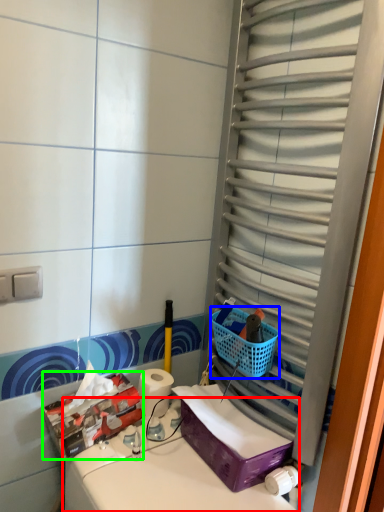
Question: Based on their relative distances, which object is farther from counter top (highlighted by a red box)? Choose from basket (highlighted by a blue box) and storage box (highlighted by a green box).

Choices:
 (A) basket
 (B) storage box

Answer: (A)